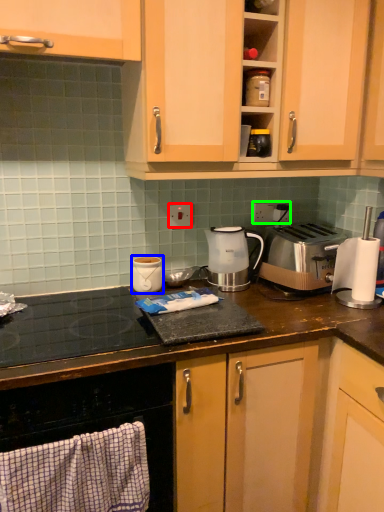
Question: Based on their relative distances, which object is farther from electric outlet (highlighted by a red box)? Choose from kitchen appliance (highlighted by a blue box) and electric outlet (highlighted by a green box).

Choices:
 (A) kitchen appliance
 (B) electric outlet

Answer: (B)